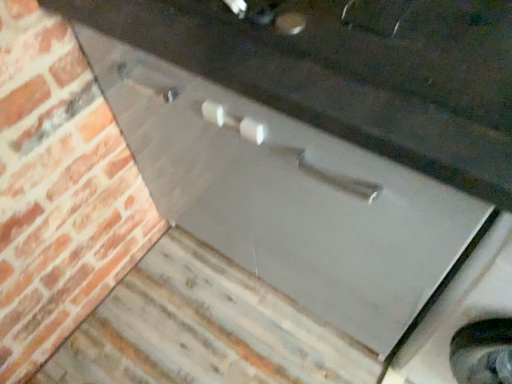
The image size is (512, 384). I want to click on satin silver drawer at center, so click(288, 196).

Measure the distance between satin silver drawer at center and camera.

satin silver drawer at center and camera are 20.34 inches apart from each other.

The image size is (512, 384). What do you see at coordinates (288, 196) in the screenshot? I see `satin silver drawer at center` at bounding box center [288, 196].

The width and height of the screenshot is (512, 384). I want to click on satin silver drawer at center, so click(288, 196).